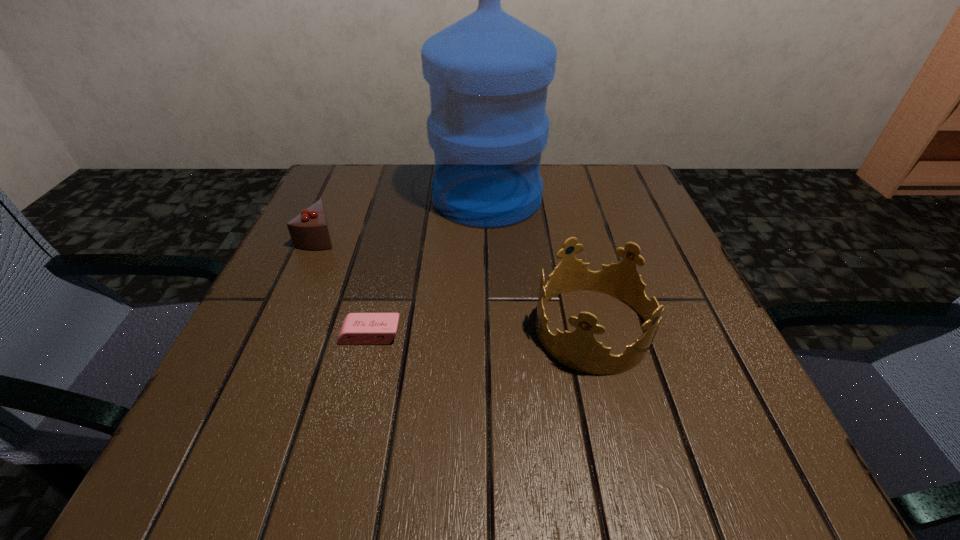
The width and height of the screenshot is (960, 540). Identify the location of vacant space located on the right of the leftmost object. (508, 235).

This screenshot has width=960, height=540. I want to click on free space located 0.220m on the back of the third object from right to left, so click(x=393, y=244).

Locate an element on the screen. Image resolution: width=960 pixels, height=540 pixels. object at the far edge is located at coordinates (488, 73).

Identify the location of chocolate cake present at the left edge. (309, 230).

Where is `eraser present at the left edge`? Image resolution: width=960 pixels, height=540 pixels. eraser present at the left edge is located at coordinates point(357,328).

Locate an element on the screen. object present at the right edge is located at coordinates (579, 350).

The width and height of the screenshot is (960, 540). Identify the location of free space at the far edge. (553, 210).

Where is `vacant position at the near edge of the desktop`? vacant position at the near edge of the desktop is located at coordinates (515, 463).

Locate an element on the screen. This screenshot has width=960, height=540. free space at the left edge is located at coordinates (358, 256).

You are a GUI agent. You are given a task and a screenshot of the screen. Output one action in this format:
    pyautogui.click(x=<x>, y=<y>)
    Task: Click on the vacant area at the right edge
    
    Given the screenshot: What is the action you would take?
    (744, 414)